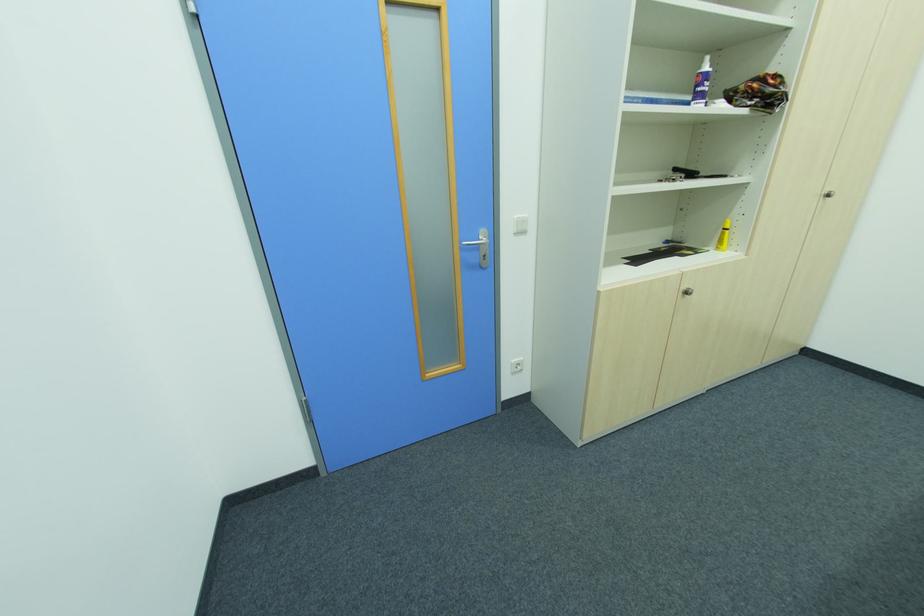
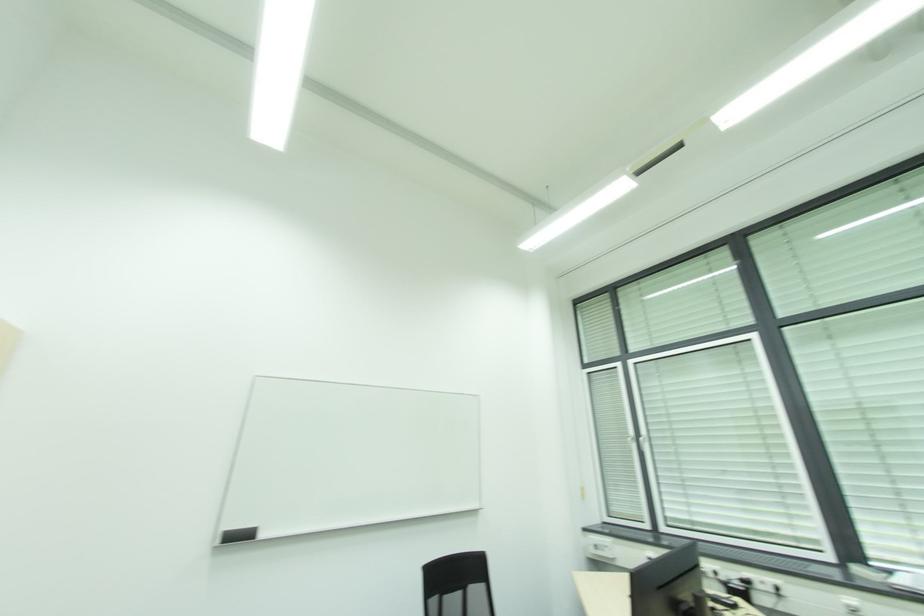
How did the camera likely rotate?

The rotation direction of the camera is right-up.